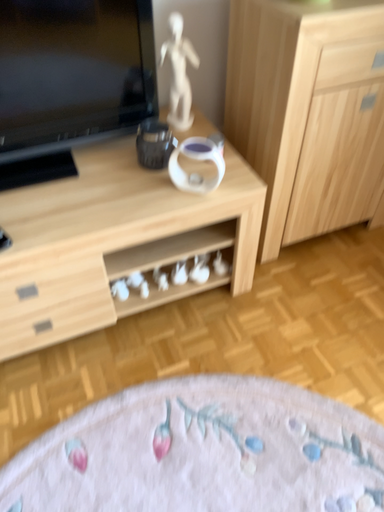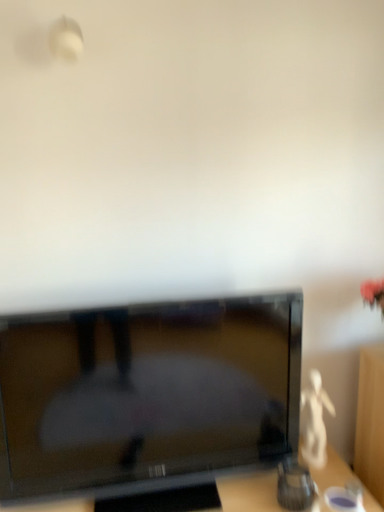
Question: How did the camera likely rotate when shooting the video?

Choices:
 (A) rotated downward
 (B) rotated upward

Answer: (B)